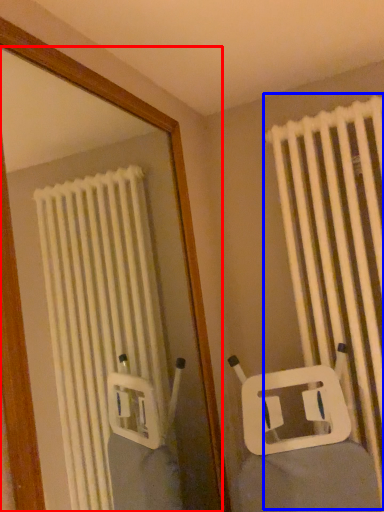
Question: Among these objects, which one is nearest to the camera, mirror (highlighted by a red box) or curtain (highlighted by a blue box)?

Choices:
 (A) mirror
 (B) curtain

Answer: (A)